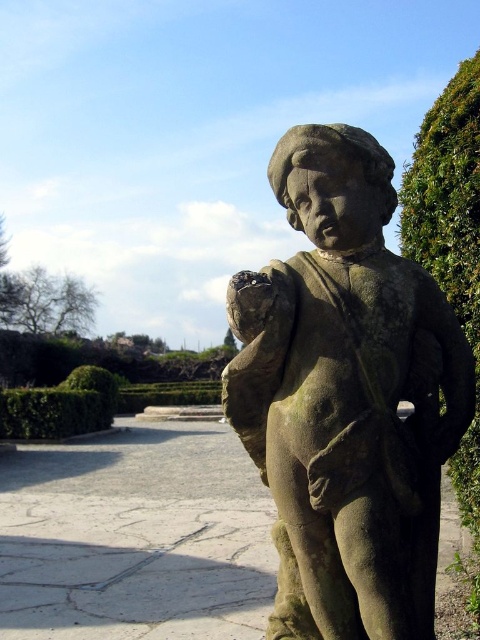
Question: Among these points, which one is nearest to the camera?

Choices:
 (A) (442, 150)
 (B) (245, 371)

Answer: (B)

Question: In this image, where is stone statue at center located relative to green leafy bush at right?

Choices:
 (A) below
 (B) above

Answer: (B)

Question: Does stone statue at center have a lesser width compared to green leafy bush at right?

Choices:
 (A) yes
 (B) no

Answer: (A)

Question: Which point is closer to the camera?

Choices:
 (A) stone statue at center
 (B) green leafy bush at right

Answer: (A)

Question: Can you confirm if stone statue at center is bigger than green leafy bush at right?

Choices:
 (A) yes
 (B) no

Answer: (B)